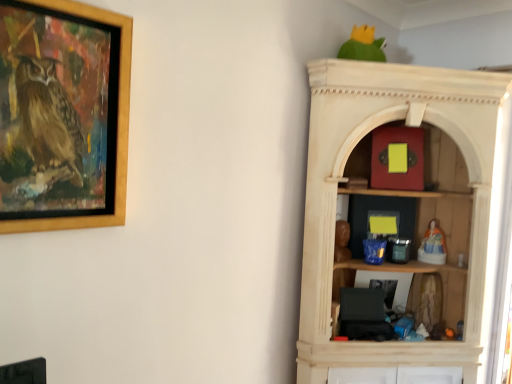
This screenshot has width=512, height=384. Identify the location of fuzzy fabric doll at right, the 4th toy from the top. (430, 301).

How much space does porcelain figurine at right, arranged as the first toy when viewed from the right, occupy horizontally?

porcelain figurine at right, arranged as the first toy when viewed from the right, is 3.62 inches in width.

The image size is (512, 384). Describe the element at coordinates (362, 45) in the screenshot. I see `green matte parrot at upper center` at that location.

Identify the location of green matte parrot at upper center. The height and width of the screenshot is (384, 512). (362, 45).

Measure the distance between point (345, 239) and camera.

The depth of point (345, 239) is 1.94 meters.

You are a GUI agent. You are given a task and a screenshot of the screen. Output one action in this format:
    pyautogui.click(x=<x>, y=<y>)
    Task: Click on the fuzzy fabric doll at right, placed as the 3th toy when sorted from left to right
    This screenshot has width=512, height=384.
    Given the screenshot: What is the action you would take?
    pyautogui.click(x=430, y=301)

Is porcelain figurine at right, positioned as the third toy in top-to-bottom order, inside wooden statue at center, arranged as the second toy when viewed from the top?

No, porcelain figurine at right, positioned as the third toy in top-to-bottom order, is not inside wooden statue at center, arranged as the second toy when viewed from the top.

Based on the photo, is wooden statue at center, the 1th toy positioned from the left, oriented away from porcelain figurine at right, positioned as the third toy in top-to-bottom order?

No, wooden statue at center, the 1th toy positioned from the left, is not facing away from porcelain figurine at right, positioned as the third toy in top-to-bottom order.

From a real-world perspective, is wooden statue at center, arranged as the second toy when viewed from the top, positioned above or below porcelain figurine at right, arranged as the first toy when viewed from the right?

wooden statue at center, arranged as the second toy when viewed from the top, is situated lower than porcelain figurine at right, arranged as the first toy when viewed from the right, in the real world.

Which of these two, wooden statue at center, acting as the 4th toy starting from the right, or porcelain figurine at right, marked as the second toy in a bottom-to-top arrangement, is thinner?

With smaller width is wooden statue at center, acting as the 4th toy starting from the right.

Which object is more forward, porcelain figurine at right, arranged as the first toy when viewed from the right, or wooden statue at center, acting as the 4th toy starting from the right?

wooden statue at center, acting as the 4th toy starting from the right, is in front.

Is porcelain figurine at right, which ranks as the 4th toy in left-to-right order, facing towards wooden statue at center, the 1th toy positioned from the left?

No, porcelain figurine at right, which ranks as the 4th toy in left-to-right order, does not turn towards wooden statue at center, the 1th toy positioned from the left.

From the image's perspective, is porcelain figurine at right, positioned as the third toy in top-to-bottom order, under wooden statue at center, arranged as the second toy when viewed from the top?

Yes, from the image's perspective, porcelain figurine at right, positioned as the third toy in top-to-bottom order, is below wooden statue at center, arranged as the second toy when viewed from the top.

Where is `the 1st toy positioned above the wooden statue at center, acting as the 4th toy starting from the right (from a real-world perspective)`? The height and width of the screenshot is (384, 512). the 1st toy positioned above the wooden statue at center, acting as the 4th toy starting from the right (from a real-world perspective) is located at coordinates (433, 245).

From the image's perspective, between wooden picture frame at upper left and green matte parrot at upper center, who is located below?

From the image's view, wooden picture frame at upper left is below.

Does wooden picture frame at upper left have a greater height compared to green matte parrot at upper center?

Correct, wooden picture frame at upper left is much taller as green matte parrot at upper center.

I want to click on parrot on the right of wooden picture frame at upper left, so click(362, 45).

Who is bigger, fuzzy fabric doll at right, which is the second toy from right to left, or wooden picture frame at upper left?

Bigger between the two is wooden picture frame at upper left.

Considering the sizes of objects fuzzy fabric doll at right, placed as the 3th toy when sorted from left to right, and wooden picture frame at upper left in the image provided, who is thinner, fuzzy fabric doll at right, placed as the 3th toy when sorted from left to right, or wooden picture frame at upper left?

fuzzy fabric doll at right, placed as the 3th toy when sorted from left to right, is thinner.

How many degrees apart are the facing directions of fuzzy fabric doll at right, the 4th toy from the top, and wooden picture frame at upper left?

The facing directions of fuzzy fabric doll at right, the 4th toy from the top, and wooden picture frame at upper left are 75 degrees apart.

Is fuzzy fabric doll at right, which appears as the 1th toy when ordered from the bottom, directly adjacent to wooden picture frame at upper left?

They are not placed beside each other.

Considering their positions, is matte red box at upper center, which is the first toy from top to bottom, located in front of or behind fuzzy fabric doll at right, which is the second toy from right to left?

Clearly, matte red box at upper center, which is the first toy from top to bottom, is in front of fuzzy fabric doll at right, which is the second toy from right to left.

From the image's perspective, which is above, matte red box at upper center, marked as the 3th toy in a right-to-left arrangement, or fuzzy fabric doll at right, the 4th toy from the top?

matte red box at upper center, marked as the 3th toy in a right-to-left arrangement.

Does matte red box at upper center, the 4th toy ordered from the bottom, have a lesser height compared to fuzzy fabric doll at right, which appears as the 1th toy when ordered from the bottom?

No, matte red box at upper center, the 4th toy ordered from the bottom, is not shorter than fuzzy fabric doll at right, which appears as the 1th toy when ordered from the bottom.

Is matte red box at upper center, marked as the 3th toy in a right-to-left arrangement, next to fuzzy fabric doll at right, which is the second toy from right to left?

No, matte red box at upper center, marked as the 3th toy in a right-to-left arrangement, is not next to fuzzy fabric doll at right, which is the second toy from right to left.

From the image's perspective, is green matte parrot at upper center beneath porcelain figurine at right, positioned as the third toy in top-to-bottom order?

No, from the image's perspective, green matte parrot at upper center is not below porcelain figurine at right, positioned as the third toy in top-to-bottom order.

Does green matte parrot at upper center turn towards porcelain figurine at right, arranged as the first toy when viewed from the right?

No, green matte parrot at upper center is not turned towards porcelain figurine at right, arranged as the first toy when viewed from the right.

Is green matte parrot at upper center inside or outside of porcelain figurine at right, positioned as the third toy in top-to-bottom order?

green matte parrot at upper center is not inside porcelain figurine at right, positioned as the third toy in top-to-bottom order, it's outside.

Considering their positions, is green matte parrot at upper center located in front of or behind porcelain figurine at right, arranged as the first toy when viewed from the right?

In the image, green matte parrot at upper center appears in front of porcelain figurine at right, arranged as the first toy when viewed from the right.

This screenshot has height=384, width=512. In the image, there is a wooden statue at center, the 1th toy positioned from the left. Find the location of `picture frame above it (from the image's perspective)`. picture frame above it (from the image's perspective) is located at coordinates coord(63,115).

In the scene shown: Is wooden picture frame at upper left to the left or to the right of wooden statue at center, the 1th toy positioned from the left, in the image?

In the image, wooden picture frame at upper left appears on the left side of wooden statue at center, the 1th toy positioned from the left.

Is point (61, 4) in front of point (335, 248)?

Yes, point (61, 4) is in front of point (335, 248).

Find the location of a particular element. This screenshot has height=384, width=512. the 3rd toy to the right of the wooden statue at center, acting as the 4th toy starting from the right, counting from the anchor's position is located at coordinates (433, 245).

From a real-world perspective, count 1st toys upward from the wooden statue at center, acting as the 4th toy starting from the right, and point to it. Please provide its 2D coordinates.

[(433, 245)]

Considering their positions, is porcelain figurine at right, which ranks as the 4th toy in left-to-right order, positioned closer to green matte parrot at upper center than wooden statue at center, the 1th toy positioned from the left?

wooden statue at center, the 1th toy positioned from the left.

Estimate the real-world distances between objects in this image. Which object is further from porcelain figurine at right, marked as the second toy in a bottom-to-top arrangement, wooden picture frame at upper left or fuzzy fabric doll at right, which is the second toy from right to left?

wooden picture frame at upper left.

When comparing their distances from fuzzy fabric doll at right, the 4th toy from the top, does green matte parrot at upper center or porcelain figurine at right, which ranks as the 4th toy in left-to-right order, seem closer?

porcelain figurine at right, which ranks as the 4th toy in left-to-right order, is closer to fuzzy fabric doll at right, the 4th toy from the top.

From the picture: Which object lies further to the anchor point wooden picture frame at upper left, matte red box at upper center, the 4th toy ordered from the bottom, or porcelain figurine at right, arranged as the first toy when viewed from the right?

The object further to wooden picture frame at upper left is porcelain figurine at right, arranged as the first toy when viewed from the right.

Consider the image. Considering their positions, is green matte parrot at upper center positioned closer to wooden picture frame at upper left than fuzzy fabric doll at right, which is the second toy from right to left?

green matte parrot at upper center.

Consider the image. Considering their positions, is wooden statue at center, the 1th toy positioned from the left, positioned further to wooden picture frame at upper left than matte red box at upper center, the 4th toy ordered from the bottom?

matte red box at upper center, the 4th toy ordered from the bottom, lies further to wooden picture frame at upper left than the other object.

Estimate the real-world distances between objects in this image. Which object is further from fuzzy fabric doll at right, placed as the 3th toy when sorted from left to right, porcelain figurine at right, marked as the second toy in a bottom-to-top arrangement, or wooden picture frame at upper left?

wooden picture frame at upper left is positioned further to the anchor fuzzy fabric doll at right, placed as the 3th toy when sorted from left to right.

Which object lies further to the anchor point wooden statue at center, the 1th toy positioned from the left, green matte parrot at upper center or fuzzy fabric doll at right, the 4th toy from the top?

Answer: green matte parrot at upper center lies further to wooden statue at center, the 1th toy positioned from the left, than the other object.

At what (x,y) coordinates should I click in order to perform the action: click on toy between wooden picture frame at upper left and green matte parrot at upper center. Please return your answer as a coordinate pair (x, y). The height and width of the screenshot is (384, 512). Looking at the image, I should click on (342, 241).

Find the location of a particular element. parrot situated between wooden picture frame at upper left and porcelain figurine at right, positioned as the third toy in top-to-bottom order, from left to right is located at coordinates (362, 45).

Where is `toy that lies between green matte parrot at upper center and wooden statue at center, acting as the 4th toy starting from the right, from top to bottom`? This screenshot has height=384, width=512. toy that lies between green matte parrot at upper center and wooden statue at center, acting as the 4th toy starting from the right, from top to bottom is located at coordinates (397, 158).

At what (x,y) coordinates should I click in order to perform the action: click on parrot between wooden picture frame at upper left and matte red box at upper center, acting as the second toy starting from the left, in the horizontal direction. Please return your answer as a coordinate pair (x, y). The height and width of the screenshot is (384, 512). Looking at the image, I should click on (362, 45).